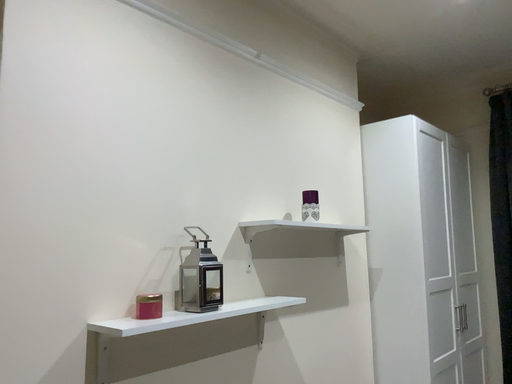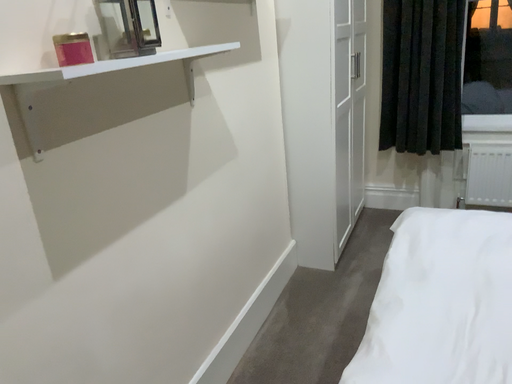
Question: Which way did the camera rotate in the video?

Choices:
 (A) rotated downward
 (B) rotated upward

Answer: (A)